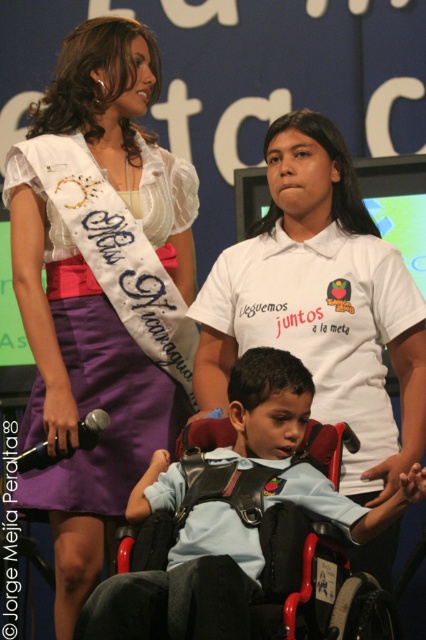
You are a photographer at the event and need to adjust the lighting so that both the purple satin sash at upper center and the light blue fabric shirt at center are equally visible. Given their sizes, which object requires more light to be shone on it?

The light blue fabric shirt at center requires more light because it is larger than the purple satin sash at upper center.

Based on the scene description, which object has a greater height between the purple satin sash at upper center and the light blue fabric shirt at center?

The purple satin sash at upper center has a greater height compared to the light blue fabric shirt at center.